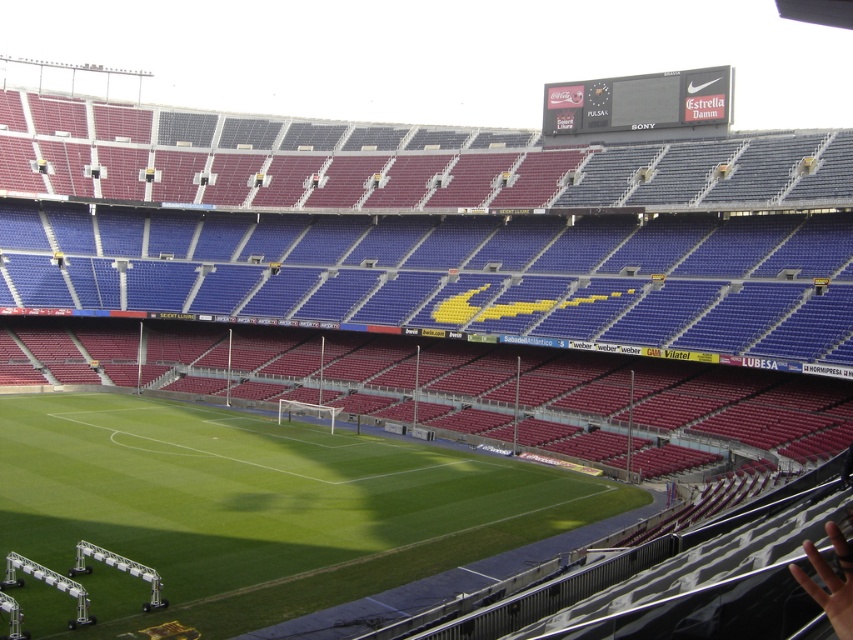
At what (x,y) coordinates should I click in order to perform the action: click on skinny hand at lower right. Please return your answer as a coordinate pair (x, y). The image size is (853, 640). Looking at the image, I should click on pyautogui.click(x=828, y=584).

Between skinny hand at lower right and white metallic goalpost at center, which one appears on the right side from the viewer's perspective?

From the viewer's perspective, skinny hand at lower right appears more on the right side.

This screenshot has height=640, width=853. I want to click on skinny hand at lower right, so click(828, 584).

Is white metallic track at lower left below metallic silver stadium lights at lower left?

No, white metallic track at lower left is not below metallic silver stadium lights at lower left.

In order to click on white metallic track at lower left in this screenshot , I will do `click(49, 584)`.

Can you confirm if green grass football field at center is wider than white metallic goalpost at center?

Yes.

Is point (61, 420) in front of point (297, 403)?

Yes, it is.

Which is in front, point (56, 490) or point (300, 404)?

Positioned in front is point (56, 490).

This screenshot has height=640, width=853. In order to click on green grass football field at center in this screenshot , I will do `click(264, 502)`.